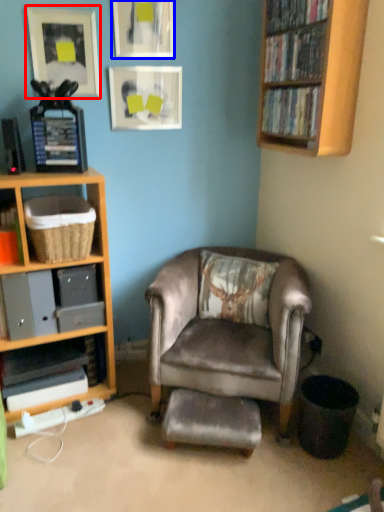
Question: Which object appears closest to the camera in this image, picture frame (highlighted by a red box) or picture frame (highlighted by a blue box)?

Choices:
 (A) picture frame
 (B) picture frame

Answer: (A)